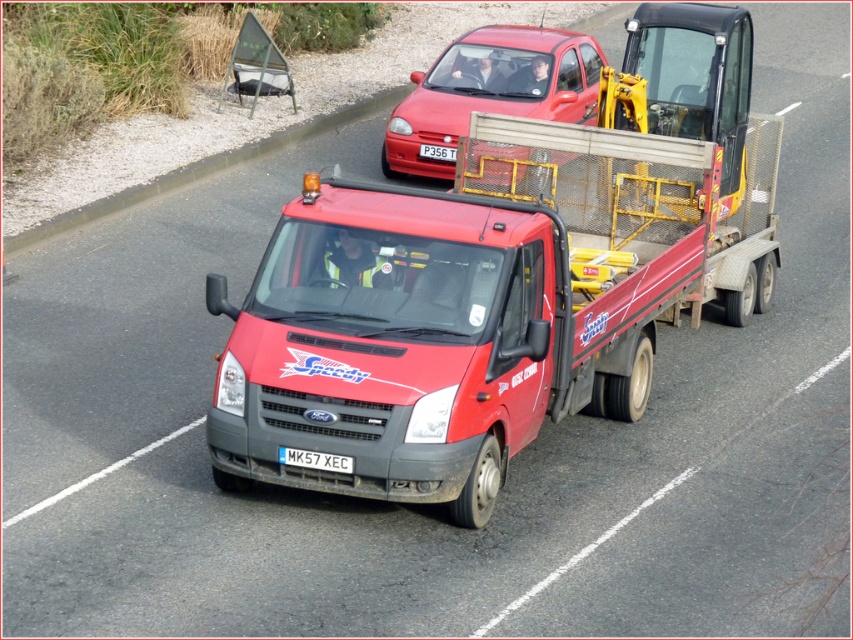
Is matte red tow truck at center wider than metallic red hatchback at upper center?

Incorrect, matte red tow truck at center's width does not surpass metallic red hatchback at upper center's.

At what (x,y) coordinates should I click in order to perform the action: click on matte red tow truck at center. Please return your answer as a coordinate pair (x, y). Image resolution: width=853 pixels, height=640 pixels. Looking at the image, I should click on (502, 280).

What do you see at coordinates (502, 280) in the screenshot? I see `matte red tow truck at center` at bounding box center [502, 280].

Identify the location of matte red tow truck at center. This screenshot has height=640, width=853. (502, 280).

Is white plastic license plate at center below red plastic license plate at center?

Correct, white plastic license plate at center is located below red plastic license plate at center.

Does point (351, 464) lie behind point (453, 150)?

No, it is not.

At what (x,y) coordinates should I click in order to perform the action: click on white plastic license plate at center. Please return your answer as a coordinate pair (x, y). This screenshot has width=853, height=640. Looking at the image, I should click on (315, 460).

This screenshot has height=640, width=853. Identify the location of metallic red hatchback at upper center. coord(492,90).

Which is in front, point (436, 74) or point (419, 148)?

Point (419, 148)

This screenshot has height=640, width=853. What are the coordinates of `metallic red hatchback at upper center` in the screenshot? It's located at (492, 90).